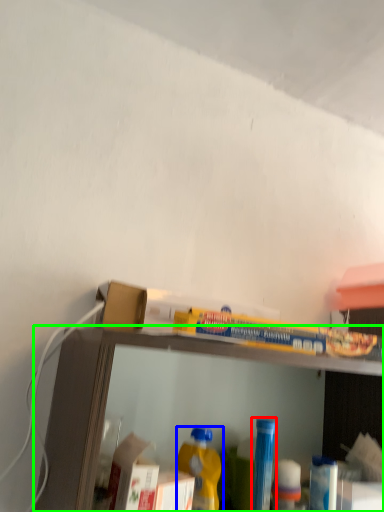
Question: Based on their relative distances, which object is nearer to bottle (highlighted by a red box)? Choose from bottle (highlighted by a blue box) and shelf (highlighted by a green box).

Choices:
 (A) bottle
 (B) shelf

Answer: (A)